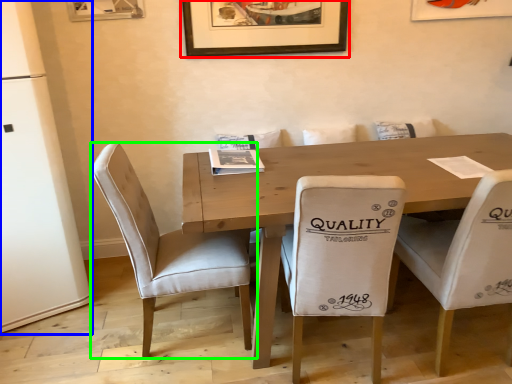
Question: Estimate the real-world distances between objects in this image. Which object is closer to picture frame (highlighted by a red box), fridge (highlighted by a blue box) or chair (highlighted by a green box)?

Choices:
 (A) fridge
 (B) chair

Answer: (B)